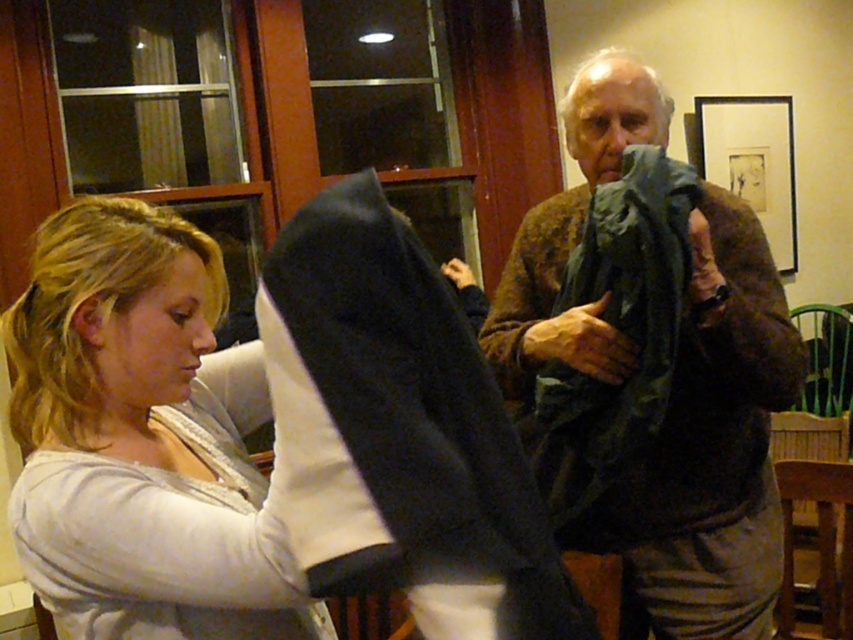
Question: Among these points, which one is farthest from the camera?

Choices:
 (A) [328, 202]
 (B) [663, 346]
 (C) [648, 467]

Answer: (C)

Question: Does black soft fabric at center appear under dark green fabric at center?

Choices:
 (A) yes
 (B) no

Answer: (A)

Question: Is textured brown sweater at upper right to the left of dark green fabric at center from the viewer's perspective?

Choices:
 (A) no
 (B) yes

Answer: (A)

Question: Which of the following is the closest to the observer?

Choices:
 (A) textured brown sweater at upper right
 (B) dark green fabric at center

Answer: (B)

Question: Is black soft fabric at center smaller than dark green fabric at center?

Choices:
 (A) no
 (B) yes

Answer: (B)

Question: Which is nearer to the textured brown sweater at upper right?

Choices:
 (A) dark green fabric at center
 (B) black soft fabric at center

Answer: (A)